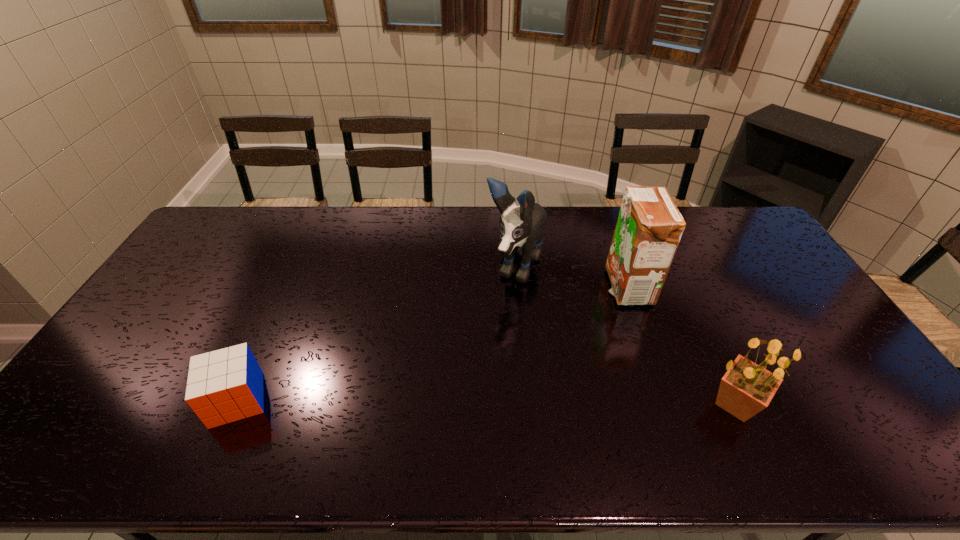
In the image, there is a desktop. Where is `vacant space at the near edge`? The width and height of the screenshot is (960, 540). vacant space at the near edge is located at coordinates (184, 411).

Find the location of a particular element. Image resolution: width=960 pixels, height=540 pixels. free location at the left edge of the desktop is located at coordinates (204, 247).

Locate an element on the screen. This screenshot has width=960, height=540. vacant region at the right edge of the desktop is located at coordinates (811, 330).

Locate an element on the screen. Image resolution: width=960 pixels, height=540 pixels. vacant area at the far right corner is located at coordinates [724, 214].

Locate an element on the screen. vacant point located between the cube and the second object from left to right is located at coordinates (376, 334).

The height and width of the screenshot is (540, 960). In order to click on empty location between the second tallest object and the shortest object in this screenshot , I will do `click(432, 343)`.

Identify the location of free point between the second shortest object and the carton. The width and height of the screenshot is (960, 540). point(682,346).

The image size is (960, 540). Find the location of `free space between the shortest object and the puppy`. free space between the shortest object and the puppy is located at coordinates (376, 334).

What are the coordinates of `unoccupied position between the rightmost object and the puppy` in the screenshot? It's located at (625, 336).

You are a GUI agent. You are given a task and a screenshot of the screen. Output one action in this format:
    pyautogui.click(x=<x>, y=<y>)
    Task: Click on the free space that is in between the shortest object and the puppy
    This screenshot has height=540, width=960.
    Given the screenshot: What is the action you would take?
    pyautogui.click(x=376, y=334)